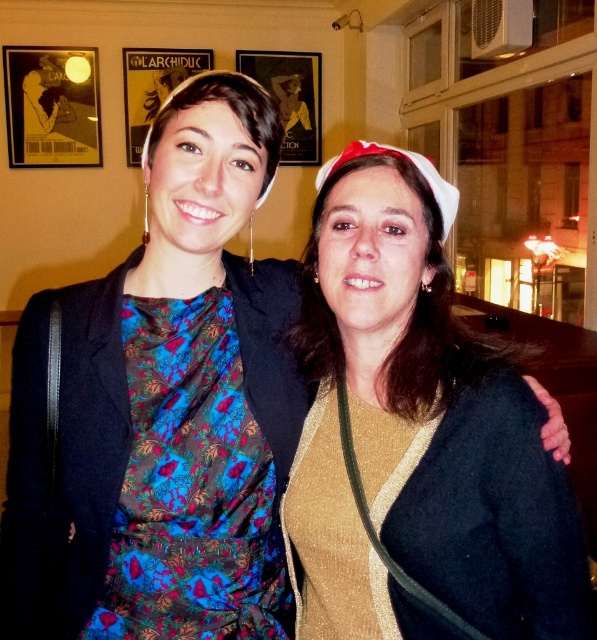
Question: Can you confirm if gold glittery sweater at center is positioned below floral print fabric dress at left?

Choices:
 (A) yes
 (B) no

Answer: (B)

Question: Which of the following is the closest to the observer?

Choices:
 (A) floral print fabric dress at left
 (B) gold glittery sweater at center

Answer: (B)

Question: Which point appears closest to the camera in this image?

Choices:
 (A) pyautogui.click(x=130, y=380)
 (B) pyautogui.click(x=426, y=205)

Answer: (B)

Question: Can you confirm if gold glittery sweater at center is thinner than floral print fabric dress at left?

Choices:
 (A) yes
 (B) no

Answer: (B)

Question: Which point is farther to the camera?

Choices:
 (A) (362, 289)
 (B) (136, 332)

Answer: (B)

Question: Can you confirm if gold glittery sweater at center is positioned above floral print fabric dress at left?

Choices:
 (A) yes
 (B) no

Answer: (A)